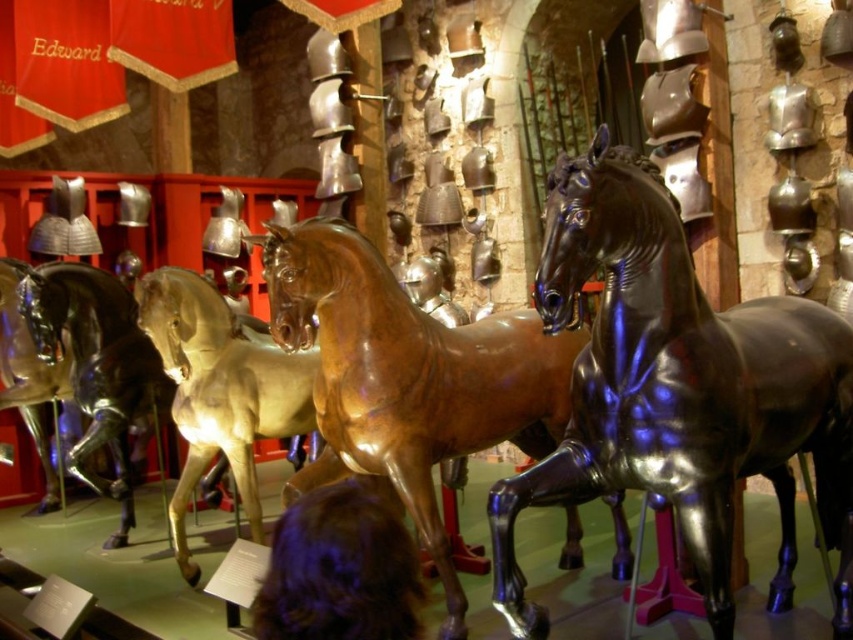
Question: Is shiny bronze horse at center thinner than shiny gold horse at center?

Choices:
 (A) no
 (B) yes

Answer: (A)

Question: Is glossy black horse at center further to camera compared to glossy metallic horse at center?

Choices:
 (A) no
 (B) yes

Answer: (A)

Question: Which of the following is the closest to the observer?

Choices:
 (A) brown hair at lower center
 (B) shiny gold horse at center

Answer: (A)

Question: Estimate the real-world distances between objects in this image. Which object is farther from the glossy black horse at center?

Choices:
 (A) glossy metallic horse at center
 (B) shiny bronze horse at center

Answer: (A)

Question: Which point appears farthest from the camera in this image?

Choices:
 (A) (227, 413)
 (B) (292, 250)
 (C) (97, 481)
 (D) (273, 540)

Answer: (C)

Question: Is shiny gold horse at center to the right of brown hair at lower center from the viewer's perspective?

Choices:
 (A) yes
 (B) no

Answer: (B)